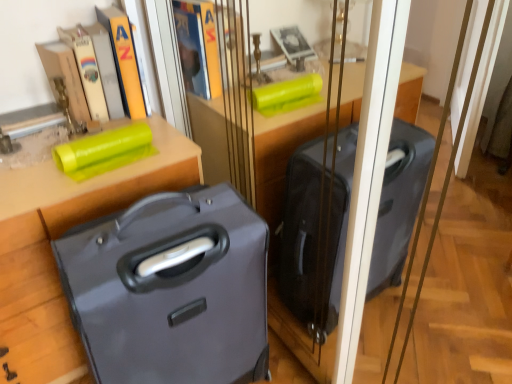
Question: Does matte black suitcase at left have a larger size compared to matte gray suitcase at lower left?

Choices:
 (A) no
 (B) yes

Answer: (B)

Question: Does matte black suitcase at left have a lesser width compared to matte gray suitcase at lower left?

Choices:
 (A) no
 (B) yes

Answer: (A)

Question: Is there a large distance between matte black suitcase at left and matte gray suitcase at lower left?

Choices:
 (A) yes
 (B) no

Answer: (B)

Question: Does matte black suitcase at left have a greater width compared to matte gray suitcase at lower left?

Choices:
 (A) yes
 (B) no

Answer: (A)

Question: Is matte black suitcase at left aimed at matte gray suitcase at lower left?

Choices:
 (A) no
 (B) yes

Answer: (B)

Question: Considering the relative positions of matte black suitcase at left and matte gray suitcase at lower left in the image provided, is matte black suitcase at left to the right of matte gray suitcase at lower left from the viewer's perspective?

Choices:
 (A) yes
 (B) no

Answer: (B)

Question: Can you confirm if matte gray suitcase at lower left is thinner than matte black suitcase at left?

Choices:
 (A) yes
 (B) no

Answer: (A)

Question: Could matte black suitcase at left be considered to be inside matte gray suitcase at lower left?

Choices:
 (A) no
 (B) yes

Answer: (A)

Question: From the image's perspective, is matte gray suitcase at lower left over matte black suitcase at left?

Choices:
 (A) yes
 (B) no

Answer: (B)

Question: From the image's perspective, is matte gray suitcase at lower left located beneath matte black suitcase at left?

Choices:
 (A) no
 (B) yes

Answer: (B)

Question: Is matte gray suitcase at lower left smaller than matte black suitcase at left?

Choices:
 (A) yes
 (B) no

Answer: (A)

Question: Is matte gray suitcase at lower left taller than matte black suitcase at left?

Choices:
 (A) no
 (B) yes

Answer: (B)

Question: Would you say matte black suitcase at left is inside or outside matte gray suitcase at lower left?

Choices:
 (A) outside
 (B) inside

Answer: (A)